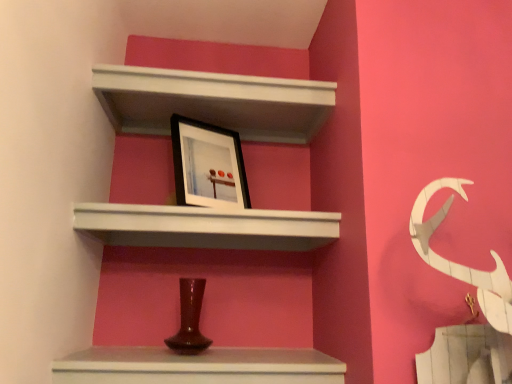
The image size is (512, 384). What do you see at coordinates (198, 366) in the screenshot? I see `matte brown vase at lower center` at bounding box center [198, 366].

What is the approximate width of black matte picture frame at upper center?

It is 4.70 inches.

This screenshot has width=512, height=384. Identify the location of white matte shelf at upper center, which appears as the 1th shelf when viewed from the top. (213, 102).

Which point is more distant from viewer, (197, 159) or (275, 214)?

The point (197, 159) is farther from the camera.

Between black matte picture frame at upper center and white matte shelf at upper center, which is the 1th shelf from bottom to top, which one has larger width?

With larger width is white matte shelf at upper center, which is the 1th shelf from bottom to top.

How different are the orientations of black matte picture frame at upper center and white matte shelf at upper center, acting as the 2th shelf starting from the top, in degrees?

black matte picture frame at upper center and white matte shelf at upper center, acting as the 2th shelf starting from the top, are facing 28.6 degrees away from each other.

Consider the image. Is black matte picture frame at upper center aimed at white matte shelf at upper center, acting as the 2th shelf starting from the top?

No, black matte picture frame at upper center does not turn towards white matte shelf at upper center, acting as the 2th shelf starting from the top.

Is black matte picture frame at upper center facing towards matte brown vase at lower center?

No.

Does black matte picture frame at upper center have a lesser width compared to matte brown vase at lower center?

Indeed, black matte picture frame at upper center has a lesser width compared to matte brown vase at lower center.

How far apart are black matte picture frame at upper center and matte brown vase at lower center?

black matte picture frame at upper center is 48.30 centimeters away from matte brown vase at lower center.

Which is correct: black matte picture frame at upper center is inside matte brown vase at lower center, or outside of it?

black matte picture frame at upper center is not inside matte brown vase at lower center, it's outside.

Is white matte shelf at upper center, acting as the 2th shelf starting from the top, at the back of matte brown vase at lower center?

No, white matte shelf at upper center, acting as the 2th shelf starting from the top, is not at the back of matte brown vase at lower center.

Between matte brown vase at lower center and white matte shelf at upper center, which is the 1th shelf from bottom to top, which one has larger size?

With larger size is white matte shelf at upper center, which is the 1th shelf from bottom to top.

From the image's perspective, which object appears higher, matte brown vase at lower center or white matte shelf at upper center, acting as the 2th shelf starting from the top?

white matte shelf at upper center, acting as the 2th shelf starting from the top, from the image's perspective.

Does matte brown vase at lower center have a greater width compared to white matte shelf at upper center, which is the 1th shelf from bottom to top?

In fact, matte brown vase at lower center might be narrower than white matte shelf at upper center, which is the 1th shelf from bottom to top.

Does matte brown vase at lower center contain white matte shelf at upper center, the second shelf from the bottom?

No, white matte shelf at upper center, the second shelf from the bottom, is located outside of matte brown vase at lower center.

What are the coordinates of `vanity located on the left of white matte shelf at upper center, the second shelf from the bottom` in the screenshot? It's located at (198, 366).

From a real-world perspective, is matte brown vase at lower center physically located above or below white matte shelf at upper center, the second shelf from the bottom?

From a real-world perspective, matte brown vase at lower center is physically below white matte shelf at upper center, the second shelf from the bottom.

In the scene shown: Considering the sizes of objects matte brown vase at lower center and white matte shelf at upper center, which appears as the 1th shelf when viewed from the top, in the image provided, who is taller, matte brown vase at lower center or white matte shelf at upper center, which appears as the 1th shelf when viewed from the top,?

matte brown vase at lower center.

I want to click on shelf below the white matte shelf at upper center, which appears as the 1th shelf when viewed from the top (from a real-world perspective), so click(206, 227).

Considering the positions of objects white matte shelf at upper center, which is the 1th shelf from bottom to top, and white matte shelf at upper center, which appears as the 1th shelf when viewed from the top, in the image provided, who is behind, white matte shelf at upper center, which is the 1th shelf from bottom to top, or white matte shelf at upper center, which appears as the 1th shelf when viewed from the top,?

white matte shelf at upper center, which appears as the 1th shelf when viewed from the top.

From a real-world perspective, between white matte shelf at upper center, acting as the 2th shelf starting from the top, and white matte shelf at upper center, the second shelf from the bottom, who is vertically lower?

From a 3D spatial view, white matte shelf at upper center, acting as the 2th shelf starting from the top, is below.

Could you tell me if white matte shelf at upper center, the second shelf from the bottom, is facing white matte shelf at upper center, which is the 1th shelf from bottom to top?

No.

Between white matte shelf at upper center, the second shelf from the bottom, and white matte shelf at upper center, acting as the 2th shelf starting from the top, which one is positioned in front?

white matte shelf at upper center, acting as the 2th shelf starting from the top, is in front.

Considering the sizes of white matte shelf at upper center, which appears as the 1th shelf when viewed from the top, and white matte shelf at upper center, which is the 1th shelf from bottom to top, in the image, is white matte shelf at upper center, which appears as the 1th shelf when viewed from the top, wider or thinner than white matte shelf at upper center, which is the 1th shelf from bottom to top,?

In the image, white matte shelf at upper center, which appears as the 1th shelf when viewed from the top, appears to be more narrow than white matte shelf at upper center, which is the 1th shelf from bottom to top.

Considering the relative positions of white matte shelf at upper center, the second shelf from the bottom, and white matte shelf at upper center, acting as the 2th shelf starting from the top, in the image provided, is white matte shelf at upper center, the second shelf from the bottom, to the right of white matte shelf at upper center, acting as the 2th shelf starting from the top, from the viewer's perspective?

Correct, you'll find white matte shelf at upper center, the second shelf from the bottom, to the right of white matte shelf at upper center, acting as the 2th shelf starting from the top.

I want to click on shelf that is the 1st object located in front of the black matte picture frame at upper center, so click(x=213, y=102).

Considering the sizes of objects white matte shelf at upper center, which appears as the 1th shelf when viewed from the top, and black matte picture frame at upper center in the image provided, who is thinner, white matte shelf at upper center, which appears as the 1th shelf when viewed from the top, or black matte picture frame at upper center?

black matte picture frame at upper center is thinner.

Is white matte shelf at upper center, which appears as the 1th shelf when viewed from the top, shorter than black matte picture frame at upper center?

Yes.

From a real-world perspective, which object rests below the other?

From a 3D spatial view, black matte picture frame at upper center is below.

Find the location of a particular element. picture frame on the left of the white matte shelf at upper center, which is the 1th shelf from bottom to top is located at coordinates (208, 165).

You are a GUI agent. You are given a task and a screenshot of the screen. Output one action in this format:
    pyautogui.click(x=<x>, y=<y>)
    Task: Click on the picture frame behind the matte brown vase at lower center
    The image size is (512, 384).
    Given the screenshot: What is the action you would take?
    pyautogui.click(x=208, y=165)

Considering their positions, is matte brown vase at lower center positioned closer to black matte picture frame at upper center than white matte shelf at upper center, which is the 1th shelf from bottom to top?

white matte shelf at upper center, which is the 1th shelf from bottom to top.

When comparing their distances from white matte shelf at upper center, which is the 1th shelf from bottom to top, does matte brown vase at lower center or black matte picture frame at upper center seem closer?

black matte picture frame at upper center is closer to white matte shelf at upper center, which is the 1th shelf from bottom to top.

Based on their spatial positions, is matte brown vase at lower center or white matte shelf at upper center, which appears as the 1th shelf when viewed from the top, closer to black matte picture frame at upper center?

white matte shelf at upper center, which appears as the 1th shelf when viewed from the top, lies closer to black matte picture frame at upper center than the other object.

From the image, which object appears to be farther from white matte shelf at upper center, acting as the 2th shelf starting from the top, black matte picture frame at upper center or matte brown vase at lower center?

matte brown vase at lower center is further to white matte shelf at upper center, acting as the 2th shelf starting from the top.

Estimate the real-world distances between objects in this image. Which object is further from black matte picture frame at upper center, white matte shelf at upper center, which is the 1th shelf from bottom to top, or matte brown vase at lower center?

Based on the image, matte brown vase at lower center appears to be further to black matte picture frame at upper center.

Which object lies nearer to the anchor point white matte shelf at upper center, which is the 1th shelf from bottom to top, black matte picture frame at upper center or white matte shelf at upper center, the second shelf from the bottom?

black matte picture frame at upper center lies closer to white matte shelf at upper center, which is the 1th shelf from bottom to top, than the other object.

Estimate the real-world distances between objects in this image. Which object is closer to black matte picture frame at upper center, white matte shelf at upper center, the second shelf from the bottom, or matte brown vase at lower center?

The object closer to black matte picture frame at upper center is white matte shelf at upper center, the second shelf from the bottom.

Looking at the image, which one is located further to white matte shelf at upper center, the second shelf from the bottom, matte brown vase at lower center or black matte picture frame at upper center?

matte brown vase at lower center lies further to white matte shelf at upper center, the second shelf from the bottom, than the other object.

Where is `shelf between black matte picture frame at upper center and matte brown vase at lower center in the up-down direction`? shelf between black matte picture frame at upper center and matte brown vase at lower center in the up-down direction is located at coordinates 206,227.

I want to click on picture frame that lies between white matte shelf at upper center, which appears as the 1th shelf when viewed from the top, and white matte shelf at upper center, acting as the 2th shelf starting from the top, from top to bottom, so click(x=208, y=165).

Locate an element on the screen. shelf between white matte shelf at upper center, the second shelf from the bottom, and matte brown vase at lower center from top to bottom is located at coordinates (206, 227).

Find the location of a particular element. picture frame that lies between white matte shelf at upper center, which appears as the 1th shelf when viewed from the top, and matte brown vase at lower center from top to bottom is located at coordinates (208, 165).